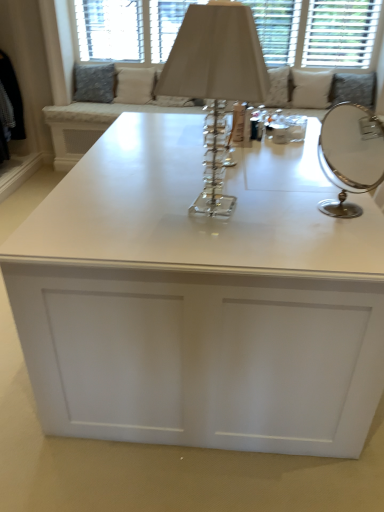
Question: Considering the relative positions of white glossy table at center and clear crystal table lamp at center in the image provided, is white glossy table at center to the left or to the right of clear crystal table lamp at center?

Choices:
 (A) left
 (B) right

Answer: (A)

Question: Is white glossy table at center taller or shorter than clear crystal table lamp at center?

Choices:
 (A) short
 (B) tall

Answer: (A)

Question: Which object is positioned closest to the white glossy table at center?

Choices:
 (A) clear crystal table lamp at center
 (B) silver/metallic round mirror at right
 (C) white fabric cushion at upper center
 (D) beige fabric pillow at upper center, positioned as the 2th pillow in right-to-left order
 (E) textured gray pillow at upper left, which is counted as the first pillow, starting from the left

Answer: (A)

Question: Estimate the real-world distances between objects in this image. Which object is closer to the clear crystal table lamp at center?

Choices:
 (A) beige fabric pillow at upper center, arranged as the 2th pillow when viewed from the left
 (B) silver/metallic round mirror at right
 (C) white glossy table at center
 (D) white fabric pillow at upper right, acting as the 1th pillow starting from the right
 (E) white fabric cushion at upper center

Answer: (C)